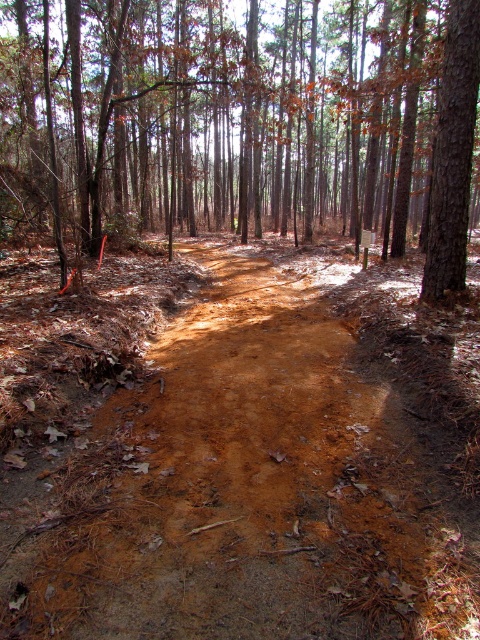
You are a hiker who wants to take a photo of both the brown bark tree at center and the brown rough tree at upper right. Which tree should you stand closer to in order to capture both in a single frame without zooming?

You should stand closer to the brown rough tree at upper right because the brown bark tree at center is larger in size, so by positioning yourself nearer to the smaller tree, both trees will fit within the camera frame.

You are a hiker trying to walk along the brown sandy dirt track at center. There is a brown bark tree at center blocking your way. Can you walk around it on the track?

The brown sandy dirt track at center is thinner than the brown bark tree at center, so there might not be enough space to walk around it on the track. Consider taking an alternative path or detour.

You are a hiker standing at the start of the brown sandy dirt track at center. You notice the brown rough tree at upper right in the distance. Which object is taller?

The brown rough tree at upper right is taller than the brown sandy dirt track at center.